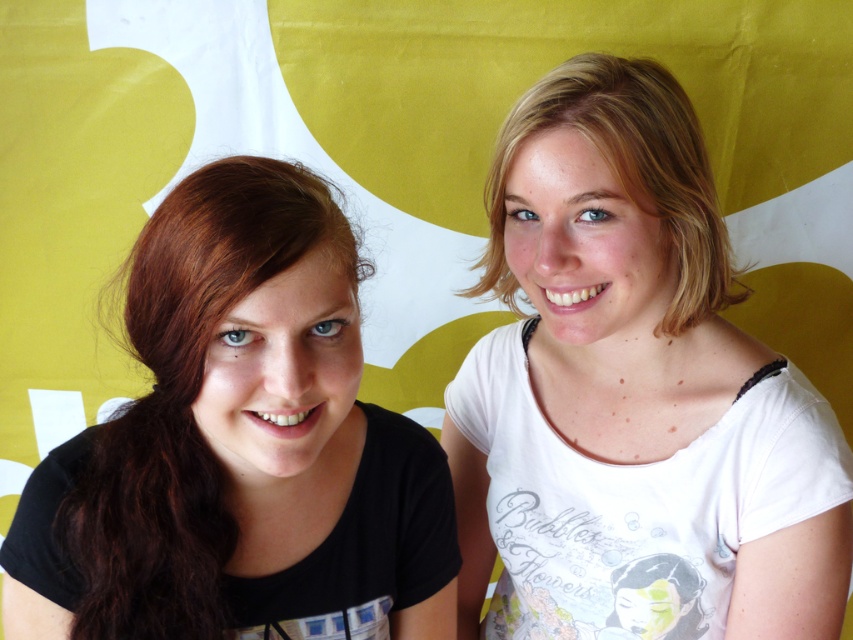
Question: Does white cotton t-shirt at upper right lie behind matte black shirt at left?

Choices:
 (A) no
 (B) yes

Answer: (B)

Question: Which of the following is the closest to the observer?

Choices:
 (A) matte black shirt at left
 (B) matte black hair at left
 (C) white cotton t-shirt at upper right

Answer: (A)

Question: Estimate the real-world distances between objects in this image. Which object is closer to the matte black shirt at left?

Choices:
 (A) white cotton t-shirt at upper right
 (B) matte black hair at left

Answer: (A)

Question: Does matte black shirt at left appear over matte black hair at left?

Choices:
 (A) no
 (B) yes

Answer: (A)

Question: Which object appears closest to the camera in this image?

Choices:
 (A) matte black hair at left
 (B) white cotton t-shirt at upper right

Answer: (A)

Question: Where is white cotton t-shirt at upper right located in relation to matte black shirt at left in the image?

Choices:
 (A) below
 (B) above

Answer: (B)